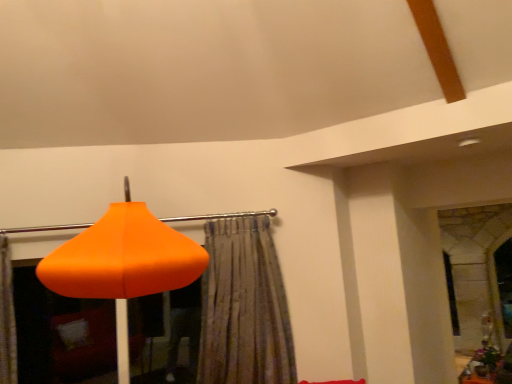
You are a GUI agent. You are given a task and a screenshot of the screen. Output one action in this format:
    pyautogui.click(x=<x>, y=<y>)
    Task: Click on the textured beige curtain at center
    The width and height of the screenshot is (512, 384).
    Given the screenshot: What is the action you would take?
    pyautogui.click(x=244, y=307)

Identify the location of wooden textured table at lower right. The image size is (512, 384). (488, 367).

Which object is more forward, textured beige curtain at center or orange matte lampshade at lower left?

orange matte lampshade at lower left is closer to the camera.

From a real-world perspective, who is located higher, textured beige curtain at center or orange matte lampshade at lower left?

In real-world perspective, orange matte lampshade at lower left is above.

Is textured beige curtain at center taller or shorter than orange matte lampshade at lower left?

textured beige curtain at center is shorter than orange matte lampshade at lower left.

From the image's perspective, which one is positioned higher, wooden textured table at lower right or orange matte lampshade at lower left?

orange matte lampshade at lower left is shown above in the image.

Is wooden textured table at lower right next to orange matte lampshade at lower left and touching it?

No, wooden textured table at lower right is not with orange matte lampshade at lower left.

From a real-world perspective, is wooden textured table at lower right physically located above or below orange matte lampshade at lower left?

Clearly, from a real-world perspective, wooden textured table at lower right is below orange matte lampshade at lower left.

From the picture: Can you confirm if orange matte lampshade at lower left is thinner than wooden textured table at lower right?

In fact, orange matte lampshade at lower left might be wider than wooden textured table at lower right.

Which is in front, orange matte lampshade at lower left or wooden textured table at lower right?

orange matte lampshade at lower left is closer to the camera.

From the image's perspective, is orange matte lampshade at lower left located beneath wooden textured table at lower right?

Actually, orange matte lampshade at lower left appears above wooden textured table at lower right in the image.

Which is more to the left, orange matte lampshade at lower left or wooden textured table at lower right?

orange matte lampshade at lower left.

From a real-world perspective, between textured beige curtain at center and wooden textured table at lower right, who is vertically lower?

From a 3D spatial view, wooden textured table at lower right is below.

In terms of size, does textured beige curtain at center appear bigger or smaller than wooden textured table at lower right?

In the image, textured beige curtain at center appears to be smaller than wooden textured table at lower right.

Is textured beige curtain at center with wooden textured table at lower right?

No, textured beige curtain at center is not beside wooden textured table at lower right.

From the image's perspective, is textured beige curtain at center under wooden textured table at lower right?

Actually, textured beige curtain at center appears above wooden textured table at lower right in the image.

Image resolution: width=512 pixels, height=384 pixels. In the image, there is a textured beige curtain at center. Identify the location of furniture below it (from a real-world perspective). (488, 367).

Based on the photo, does wooden textured table at lower right have a greater height compared to textured beige curtain at center?

No, wooden textured table at lower right is not taller than textured beige curtain at center.

Considering the sizes of objects wooden textured table at lower right and textured beige curtain at center in the image provided, who is smaller, wooden textured table at lower right or textured beige curtain at center?

With smaller size is textured beige curtain at center.

Which of these two, orange matte lampshade at lower left or textured beige curtain at center, stands shorter?

textured beige curtain at center.

Does orange matte lampshade at lower left appear on the left side of textured beige curtain at center?

Yes.

Does point (135, 235) appear closer or farther from the camera than point (241, 365)?

Point (135, 235) appears to be closer to the viewer than point (241, 365).

Between orange matte lampshade at lower left and textured beige curtain at center, which one has smaller size?

textured beige curtain at center is smaller.

Identify the location of curtain on the right of orange matte lampshade at lower left. This screenshot has width=512, height=384. click(244, 307).

Find the location of a particular element. This screenshot has width=512, height=384. furniture lying below the orange matte lampshade at lower left (from the image's perspective) is located at coordinates (488, 367).

Which object lies nearer to the anchor point orange matte lampshade at lower left, wooden textured table at lower right or textured beige curtain at center?

Based on the image, textured beige curtain at center appears to be nearer to orange matte lampshade at lower left.

Estimate the real-world distances between objects in this image. Which object is closer to textured beige curtain at center, wooden textured table at lower right or orange matte lampshade at lower left?

Based on the image, orange matte lampshade at lower left appears to be nearer to textured beige curtain at center.

When comparing their distances from wooden textured table at lower right, does orange matte lampshade at lower left or textured beige curtain at center seem further?

orange matte lampshade at lower left is positioned further to the anchor wooden textured table at lower right.

Which object lies nearer to the anchor point textured beige curtain at center, orange matte lampshade at lower left or wooden textured table at lower right?

Among the two, orange matte lampshade at lower left is located nearer to textured beige curtain at center.

Looking at the image, which one is located closer to wooden textured table at lower right, textured beige curtain at center or orange matte lampshade at lower left?

Among the two, textured beige curtain at center is located nearer to wooden textured table at lower right.

From the image, which object appears to be nearer to orange matte lampshade at lower left, textured beige curtain at center or wooden textured table at lower right?

textured beige curtain at center is positioned closer to the anchor orange matte lampshade at lower left.

This screenshot has height=384, width=512. In order to click on curtain between orange matte lampshade at lower left and wooden textured table at lower right from left to right in this screenshot , I will do `click(244, 307)`.